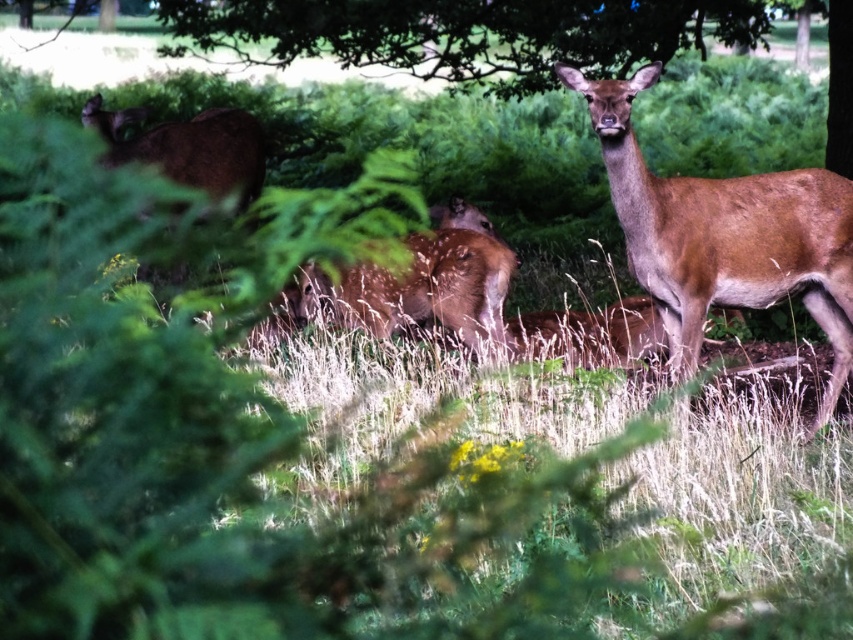
Question: Is green leafy tree at upper center smaller than brown fur deer at center?

Choices:
 (A) yes
 (B) no

Answer: (A)

Question: Among these objects, which one is nearest to the camera?

Choices:
 (A) green leafy tree at upper center
 (B) brown fur deer at center

Answer: (B)

Question: Does green leafy tree at upper center appear over brown fur deer at center?

Choices:
 (A) yes
 (B) no

Answer: (A)

Question: Is green leafy tree at upper center below brown fur deer at center?

Choices:
 (A) yes
 (B) no

Answer: (B)